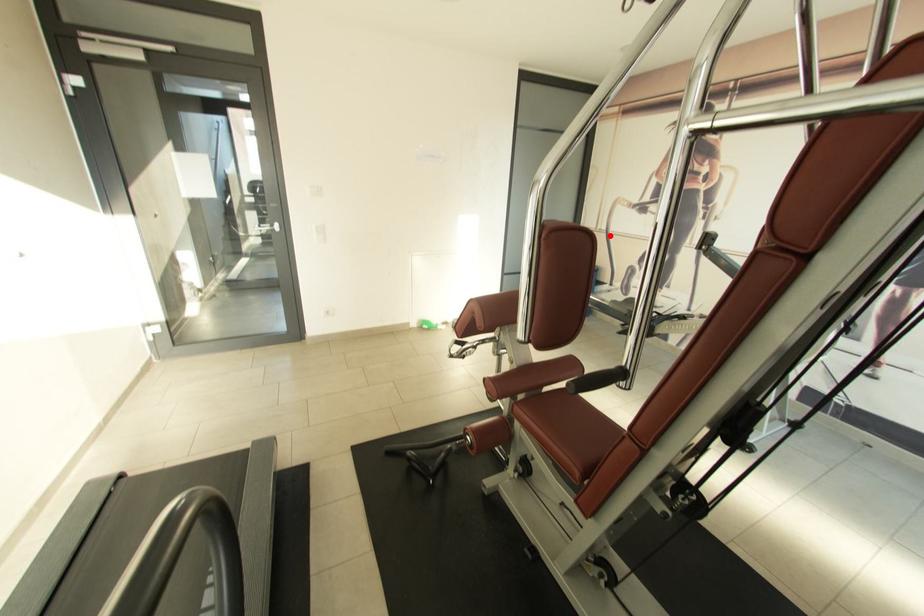
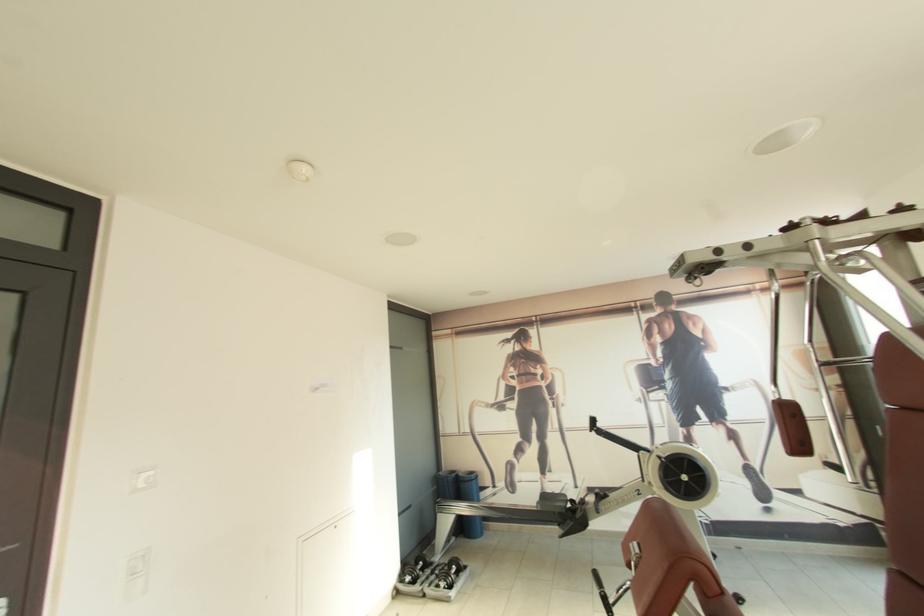
Question: I am providing you with two images of the same scene from different viewpoints. In image1, a red point is highlighted. Considering the same 3D point in image2, which of the following is correct?

Choices:
 (A) It is closer
 (B) It is farther

Answer: (B)